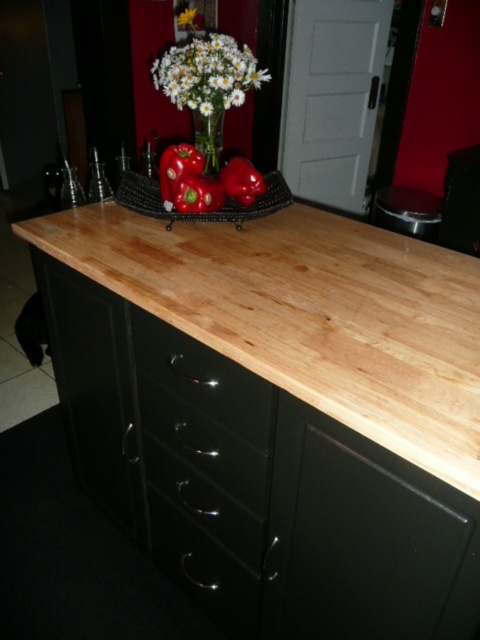
Question: Is red glossy bell pepper at center above green matte bell pepper at center?

Choices:
 (A) no
 (B) yes

Answer: (B)

Question: Which of these objects is positioned farthest from the white matte flower at upper center?

Choices:
 (A) natural wood counter at center
 (B) green matte bell pepper at center
 (C) glossy red bell pepper at center
 (D) white matte flowers at upper center

Answer: (A)

Question: Is red glossy bell pepper at center wider than green matte bell pepper at center?

Choices:
 (A) yes
 (B) no

Answer: (A)

Question: Which point is closer to the camera?

Choices:
 (A) white matte flower at center
 (B) green matte bell pepper at center
 (C) natural wood counter at center

Answer: (C)

Question: Can you confirm if white matte flowers at upper center is positioned above clear glass vase at center?

Choices:
 (A) no
 (B) yes

Answer: (B)

Question: Which is nearer to the white matte flowers at upper center?

Choices:
 (A) green matte bell pepper at center
 (B) white matte flower at upper center

Answer: (B)